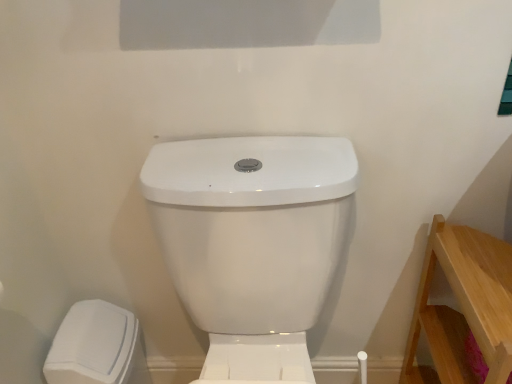
Describe the element at coordinates (97, 347) in the screenshot. I see `white matte trash can at lower left` at that location.

Locate an element on the screen. white matte trash can at lower left is located at coordinates (97, 347).

This screenshot has width=512, height=384. What are the coordinates of `white glossy toilet at center` in the screenshot? It's located at [253, 243].

At what (x,y) coordinates should I click in order to perform the action: click on light wood/rough wooden stool at lower right. Please return your answer as a coordinate pair (x, y). Looking at the image, I should click on (463, 307).

Is white glossy toilet at center shorter than light wood/rough wooden stool at lower right?

No.

Consider the image. Is white glossy toilet at center further to the viewer compared to light wood/rough wooden stool at lower right?

No, white glossy toilet at center is closer to the camera.

Does point (188, 167) appear closer or farther from the camera than point (446, 227)?

Point (188, 167) is closer to the camera than point (446, 227).

In terms of size, does light wood/rough wooden stool at lower right appear bigger or smaller than white matte trash can at lower left?

light wood/rough wooden stool at lower right is bigger than white matte trash can at lower left.

From a real-world perspective, is light wood/rough wooden stool at lower right located higher than white matte trash can at lower left?

Yes.

Which is correct: light wood/rough wooden stool at lower right is inside white matte trash can at lower left, or outside of it?

light wood/rough wooden stool at lower right is spatially situated outside white matte trash can at lower left.

Is the depth of light wood/rough wooden stool at lower right greater than that of white matte trash can at lower left?

No, light wood/rough wooden stool at lower right is in front of white matte trash can at lower left.

How different are the orientations of white matte trash can at lower left and white glossy toilet at center in degrees?

They differ by 90.4 degrees in their facing directions.

Which is more to the left, white matte trash can at lower left or white glossy toilet at center?

white matte trash can at lower left.

Which point is more forward, (98,379) or (285,151)?

The point (285,151) is closer.

How distant is white matte trash can at lower left from white glossy toilet at center?

white matte trash can at lower left and white glossy toilet at center are 42.07 centimeters apart.

From the picture: Is light wood/rough wooden stool at lower right beside white glossy toilet at center?

No, light wood/rough wooden stool at lower right is not beside white glossy toilet at center.

In terms of height, does light wood/rough wooden stool at lower right look taller or shorter compared to white glossy toilet at center?

Clearly, light wood/rough wooden stool at lower right is shorter compared to white glossy toilet at center.

Which object is closer to the camera, light wood/rough wooden stool at lower right or white glossy toilet at center?

white glossy toilet at center is closer to the camera.

Which of these two, white glossy toilet at center or white matte trash can at lower left, is wider?

Wider between the two is white glossy toilet at center.

Which is less distant, (350, 217) or (93, 376)?

Point (350, 217) appears to be closer to the viewer than point (93, 376).

How different are the orientations of white glossy toilet at center and white matte trash can at lower left in degrees?

There is a 90.4-degree angle between the facing directions of white glossy toilet at center and white matte trash can at lower left.

From a real-world perspective, is white matte trash can at lower left physically below light wood/rough wooden stool at lower right?

Yes, from a real-world perspective, white matte trash can at lower left is under light wood/rough wooden stool at lower right.

Is white matte trash can at lower left wider or thinner than light wood/rough wooden stool at lower right?

In the image, white matte trash can at lower left appears to be more narrow than light wood/rough wooden stool at lower right.

Does white matte trash can at lower left turn towards light wood/rough wooden stool at lower right?

Yes, white matte trash can at lower left is facing light wood/rough wooden stool at lower right.

Considering the sizes of white matte trash can at lower left and light wood/rough wooden stool at lower right in the image, is white matte trash can at lower left taller or shorter than light wood/rough wooden stool at lower right?

Considering their sizes, white matte trash can at lower left has less height than light wood/rough wooden stool at lower right.

The image size is (512, 384). In the image, there is a white glossy toilet at center. Find the location of `furniture below it (from the image's perspective)`. furniture below it (from the image's perspective) is located at coordinates (463, 307).

The width and height of the screenshot is (512, 384). I want to click on furniture that appears on the right of white matte trash can at lower left, so click(463, 307).

From the image, which object appears to be farther from white glossy toilet at center, white matte trash can at lower left or light wood/rough wooden stool at lower right?

white matte trash can at lower left is further to white glossy toilet at center.

From the image, which object appears to be nearer to light wood/rough wooden stool at lower right, white matte trash can at lower left or white glossy toilet at center?

Among the two, white glossy toilet at center is located nearer to light wood/rough wooden stool at lower right.

When comparing their distances from white glossy toilet at center, does light wood/rough wooden stool at lower right or white matte trash can at lower left seem further?

white matte trash can at lower left is positioned further to the anchor white glossy toilet at center.

Based on their spatial positions, is white glossy toilet at center or light wood/rough wooden stool at lower right further from white matte trash can at lower left?

light wood/rough wooden stool at lower right lies further to white matte trash can at lower left than the other object.

Considering their positions, is white glossy toilet at center positioned further to light wood/rough wooden stool at lower right than white matte trash can at lower left?

white matte trash can at lower left lies further to light wood/rough wooden stool at lower right than the other object.

When comparing their distances from white matte trash can at lower left, does light wood/rough wooden stool at lower right or white glossy toilet at center seem closer?

The object closer to white matte trash can at lower left is white glossy toilet at center.

The height and width of the screenshot is (384, 512). I want to click on toilet between white matte trash can at lower left and light wood/rough wooden stool at lower right in the horizontal direction, so click(x=253, y=243).